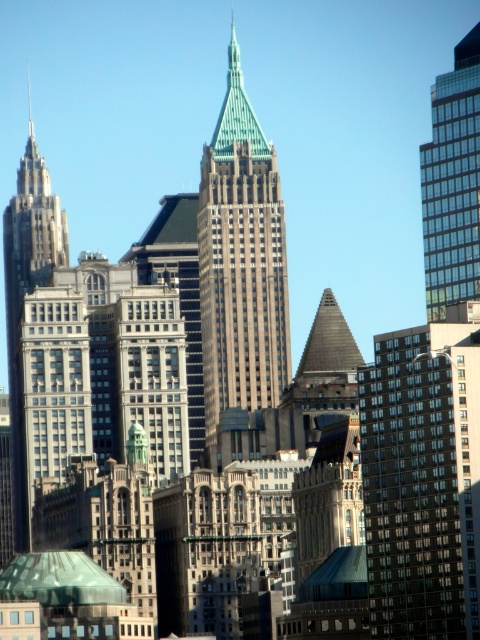
You are standing at the point with coordinates point (453,198) and want to walk towards the point with coordinates point (196,228). Will the tall building with the greenish blue pointed spire block your path?

Yes, the tall building with the greenish blue pointed spire will block your path because point (196,228) is behind point (453,198).